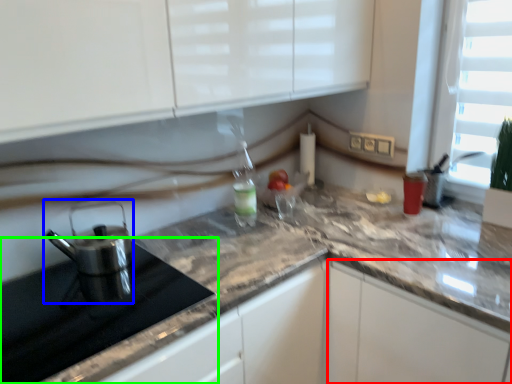
Question: Estimate the real-world distances between objects in this image. Which object is farther from cabinetry (highlighted by a red box), kitchen appliance (highlighted by a blue box) or appliance (highlighted by a green box)?

Choices:
 (A) kitchen appliance
 (B) appliance

Answer: (A)